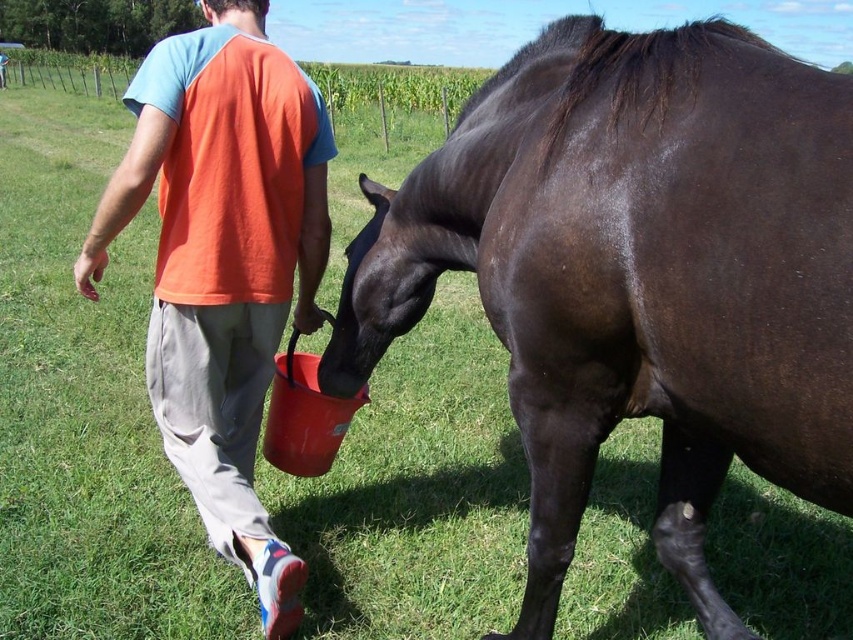
Question: Which of the following is the closest to the observer?

Choices:
 (A) (227, 560)
 (B) (494, 260)

Answer: (B)

Question: Is shiny dark brown horse at center closer to camera compared to orange cotton t-shirt at center?

Choices:
 (A) yes
 (B) no

Answer: (A)

Question: Does shiny dark brown horse at center appear over orange cotton t-shirt at center?

Choices:
 (A) no
 (B) yes

Answer: (A)

Question: Can you confirm if shiny dark brown horse at center is positioned to the right of orange cotton t-shirt at center?

Choices:
 (A) no
 (B) yes

Answer: (B)